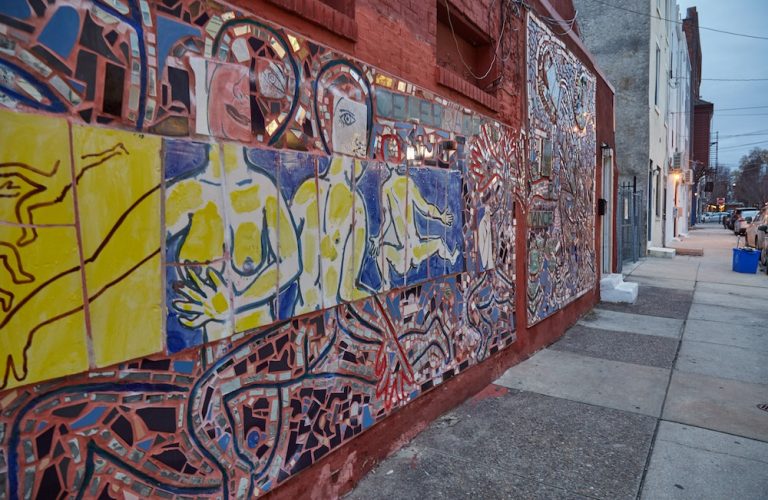
You are a GUI agent. You are given a task and a screenshot of the screen. Output one action in this format:
    pyautogui.click(x=<x>, y=<y>)
    Task: Click on the white stairs
    This screenshot has height=500, width=768.
    Given the screenshot: What is the action you would take?
    pyautogui.click(x=626, y=292)